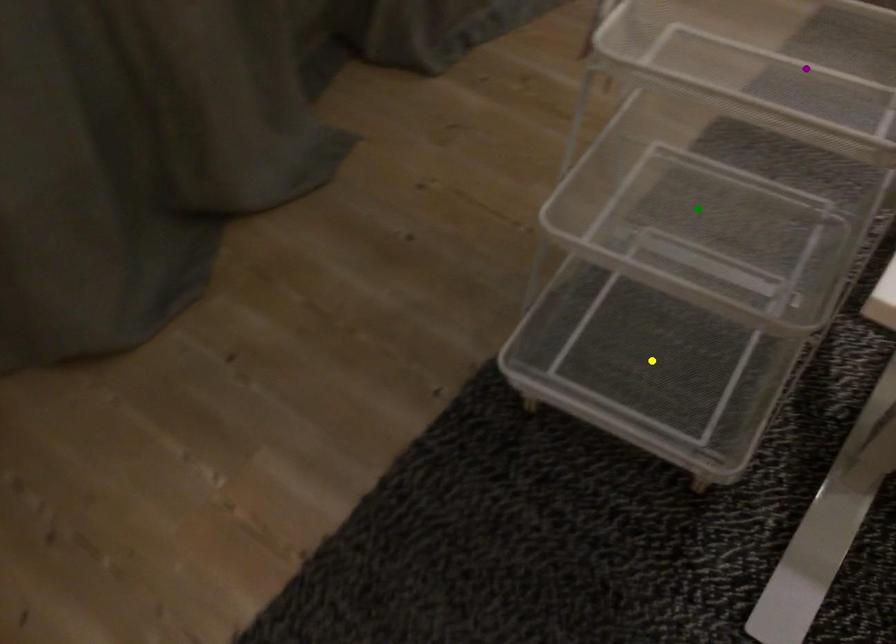
Order these from nearest to farthest:
A) yellow point
B) green point
C) purple point

purple point < green point < yellow point